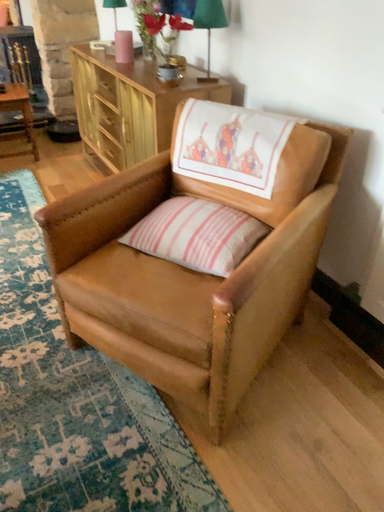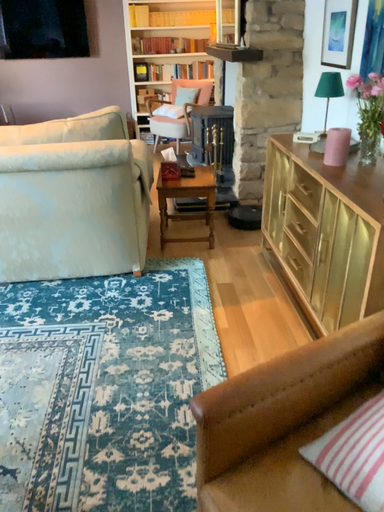
Question: How did the camera likely rotate when shooting the video?

Choices:
 (A) rotated upward
 (B) rotated downward

Answer: (A)